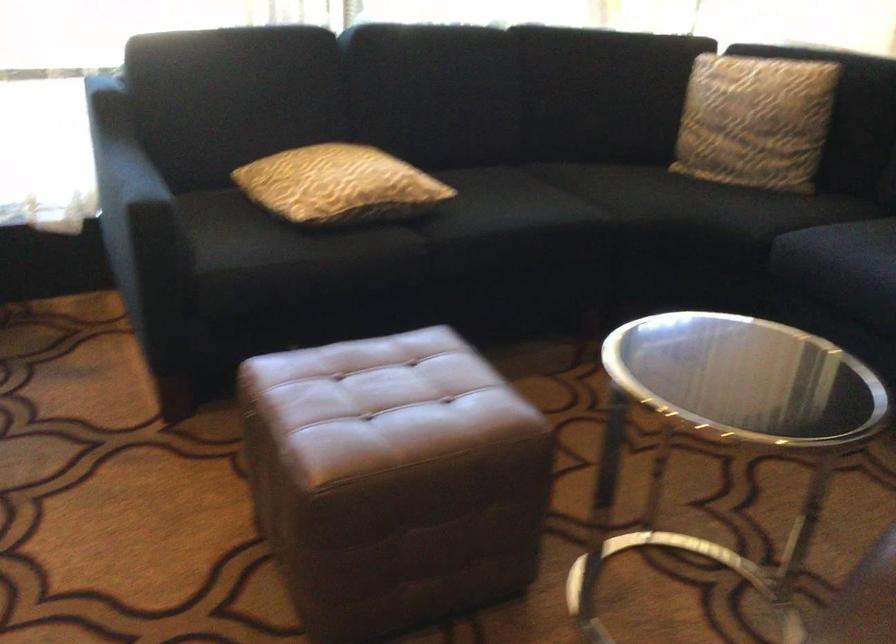
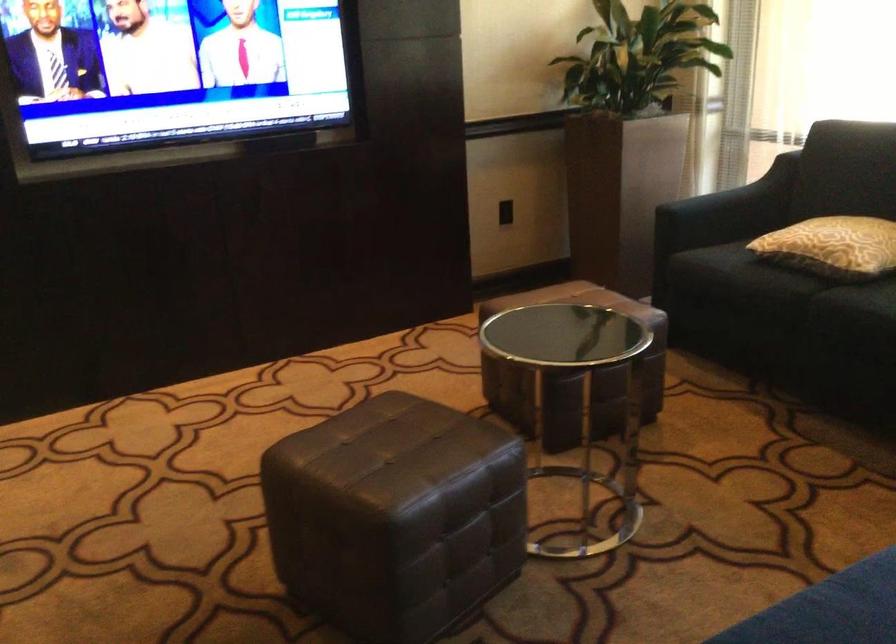
The point at (x=118, y=162) is marked in the first image. Where is the corresponding point in the second image?

(726, 184)